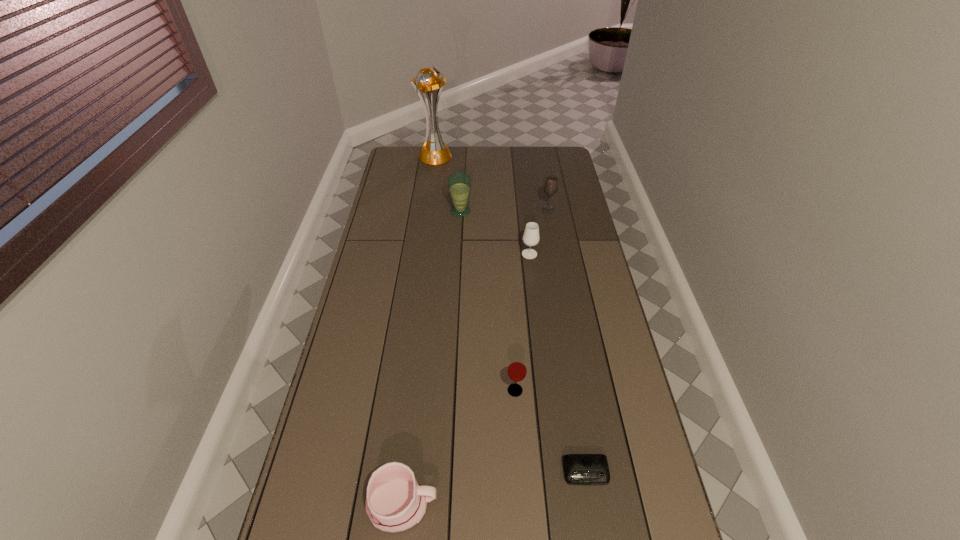
Locate an element on the screen. The image size is (960, 540). the farthest object is located at coordinates (434, 152).

At what (x,y) coordinates should I click in order to perform the action: click on trophy. Please return your answer as a coordinate pair (x, y). The height and width of the screenshot is (540, 960). Looking at the image, I should click on click(x=434, y=152).

Identify the location of the leftmost glass. (459, 184).

This screenshot has width=960, height=540. I want to click on the rightmost glass, so click(x=551, y=185).

The image size is (960, 540). In order to click on the nearest glass in this screenshot , I will do `click(517, 369)`.

Identify the location of the second glass from left to right. (517, 369).

Find the location of a particular element. This screenshot has height=540, width=960. the third glass from left to right is located at coordinates [x=531, y=237].

At what (x,y) coordinates should I click in order to perform the action: click on the fourth nearest object. Please return your answer as a coordinate pair (x, y). Looking at the image, I should click on point(531,237).

Identify the location of the second shortest object. (395, 502).

Image resolution: width=960 pixels, height=540 pixels. In order to click on alarm clock in this screenshot , I will do `click(579, 469)`.